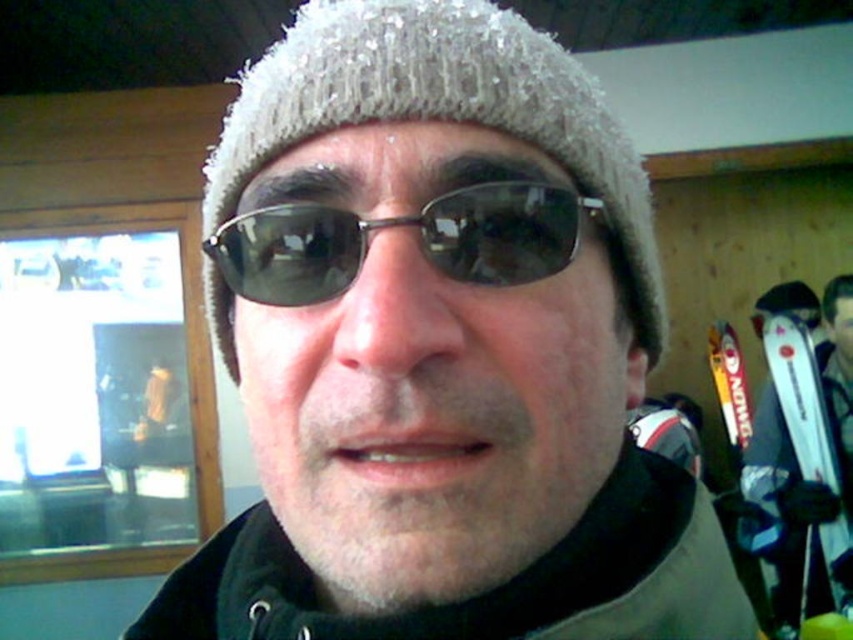
You are standing in front of the wooden cabin window and see two points marked on the image. Which point, point (233, 276) or point (804, 596), is closer to you?

Point (233, 276) is closer to you because it is in front of point (804, 596).

You are a photographer trying to capture the reflection of the surroundings on the sunglasses at center and the white glossy ski at right. Which object would show a smaller reflection area due to its size?

The sunglasses at center has a lesser height compared to the white glossy ski at right, so the sunglasses at center would show a smaller reflection area due to its smaller size.